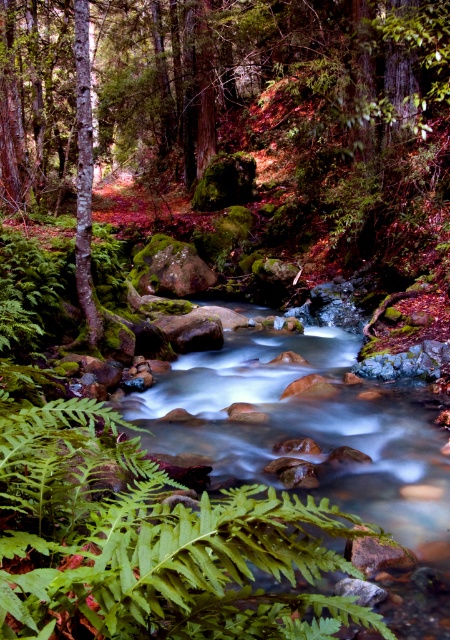
Does green leafy fern at lower left appear over smooth bark tree at left?

No, green leafy fern at lower left is not above smooth bark tree at left.

How much distance is there between green leafy fern at lower left and smooth bark tree at left?

green leafy fern at lower left and smooth bark tree at left are 4.85 meters apart.

Between point (293, 632) and point (82, 198), which one is positioned behind?

Positioned behind is point (82, 198).

Locate an element on the screen. green leafy fern at lower left is located at coordinates (149, 545).

Can you confirm if green mossy rock at center is shorter than green leafy fern at lower left?

In fact, green mossy rock at center may be taller than green leafy fern at lower left.

Does green mossy rock at center appear on the right side of green leafy fern at lower left?

Incorrect, green mossy rock at center is not on the right side of green leafy fern at lower left.

Locate an element on the screen. green mossy rock at center is located at coordinates (287, 122).

You are a GUI agent. You are given a task and a screenshot of the screen. Output one action in this format:
    pyautogui.click(x=<x>, y=<y>)
    Task: Click on the green mossy rock at center
    The height and width of the screenshot is (640, 450).
    Given the screenshot: What is the action you would take?
    pyautogui.click(x=287, y=122)

Who is positioned more to the right, green mossy rock at center or smooth bark tree at left?

From the viewer's perspective, green mossy rock at center appears more on the right side.

From the picture: Is green mossy rock at center further to the viewer compared to smooth bark tree at left?

Yes.

At what (x,y) coordinates should I click in order to perform the action: click on green mossy rock at center. Please return your answer as a coordinate pair (x, y). Image resolution: width=450 pixels, height=640 pixels. Looking at the image, I should click on (287, 122).